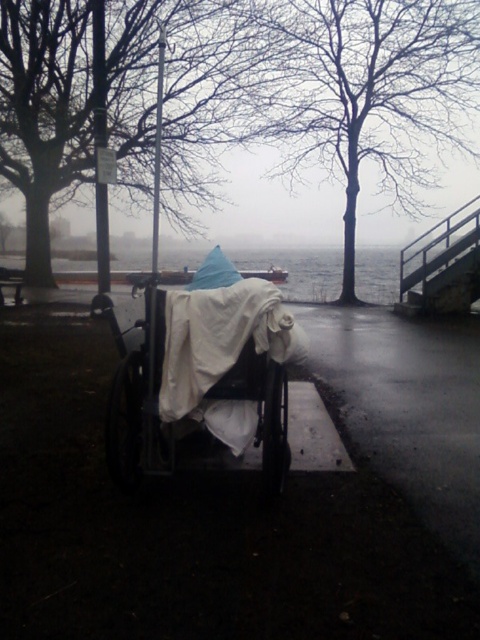
Question: Which object is farther from the camera taking this photo?

Choices:
 (A) bare branches at upper center
 (B) white fabric-covered baby carriage at center

Answer: (A)

Question: Does bare branches at upper center appear over white fabric-covered baby carriage at center?

Choices:
 (A) no
 (B) yes

Answer: (B)

Question: Considering the relative positions of bare branches at upper center and white fabric-covered baby carriage at center in the image provided, where is bare branches at upper center located with respect to white fabric-covered baby carriage at center?

Choices:
 (A) right
 (B) left

Answer: (A)

Question: Which of the following is the farthest from the observer?

Choices:
 (A) bare branches at upper center
 (B) white fabric-covered baby carriage at center

Answer: (A)

Question: From the image, what is the correct spatial relationship of bare branches at upper center in relation to white fabric-covered baby carriage at center?

Choices:
 (A) below
 (B) above

Answer: (B)